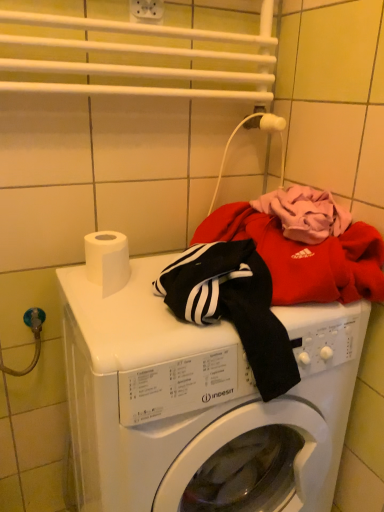
Question: Is white matte toilet paper at top left further to camera compared to white glossy washing machine at center?

Choices:
 (A) yes
 (B) no

Answer: (A)

Question: Is white matte toilet paper at top left taller than white glossy washing machine at center?

Choices:
 (A) yes
 (B) no

Answer: (B)

Question: Could white glossy washing machine at center be considered to be inside white matte toilet paper at top left?

Choices:
 (A) no
 (B) yes

Answer: (A)

Question: Is white matte toilet paper at top left turned away from white glossy washing machine at center?

Choices:
 (A) yes
 (B) no

Answer: (B)

Question: Can you confirm if white matte toilet paper at top left is smaller than white glossy washing machine at center?

Choices:
 (A) no
 (B) yes

Answer: (B)

Question: Would you say white matte toilet paper at top left is to the left or to the right of white plastic electric outlet at upper center in the picture?

Choices:
 (A) right
 (B) left

Answer: (B)

Question: From the image's perspective, relative to white plastic electric outlet at upper center, is white matte toilet paper at top left above or below?

Choices:
 (A) above
 (B) below

Answer: (B)

Question: Is point (124, 250) closer or farther from the camera than point (145, 5)?

Choices:
 (A) closer
 (B) farther

Answer: (A)

Question: Considering the positions of white matte toilet paper at top left and white plastic electric outlet at upper center in the image, is white matte toilet paper at top left taller or shorter than white plastic electric outlet at upper center?

Choices:
 (A) tall
 (B) short

Answer: (A)

Question: Is white matte toilet paper at top left wider or thinner than white glossy washing machine at center?

Choices:
 (A) thin
 (B) wide

Answer: (A)

Question: Looking at the image, does white matte toilet paper at top left seem bigger or smaller compared to white glossy washing machine at center?

Choices:
 (A) big
 (B) small

Answer: (B)

Question: From the image's perspective, is white matte toilet paper at top left located above or below white glossy washing machine at center?

Choices:
 (A) below
 (B) above

Answer: (B)

Question: Is white matte toilet paper at top left in front of or behind white glossy washing machine at center in the image?

Choices:
 (A) front
 (B) behind

Answer: (B)

Question: From their relative heights in the image, would you say white plastic electric outlet at upper center is taller or shorter than white glossy washing machine at center?

Choices:
 (A) short
 (B) tall

Answer: (A)

Question: Is point (155, 16) positioned closer to the camera than point (241, 434)?

Choices:
 (A) closer
 (B) farther

Answer: (B)